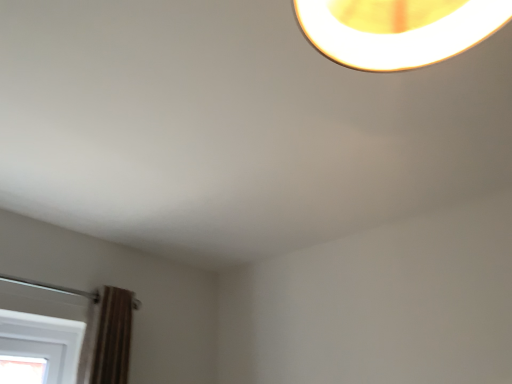
What is the approximate width of white glossy lampshade at upper center?

Result: white glossy lampshade at upper center is 26.54 centimeters wide.

This screenshot has width=512, height=384. I want to click on white glossy lampshade at upper center, so click(400, 35).

Measure the distance between white glossy lampshade at upper center and camera.

The distance of white glossy lampshade at upper center from camera is 55.57 centimeters.

The image size is (512, 384). What do you see at coordinates (400, 35) in the screenshot?
I see `white glossy lampshade at upper center` at bounding box center [400, 35].

Locate an element on the screen. The width and height of the screenshot is (512, 384). white glossy lampshade at upper center is located at coordinates (400, 35).